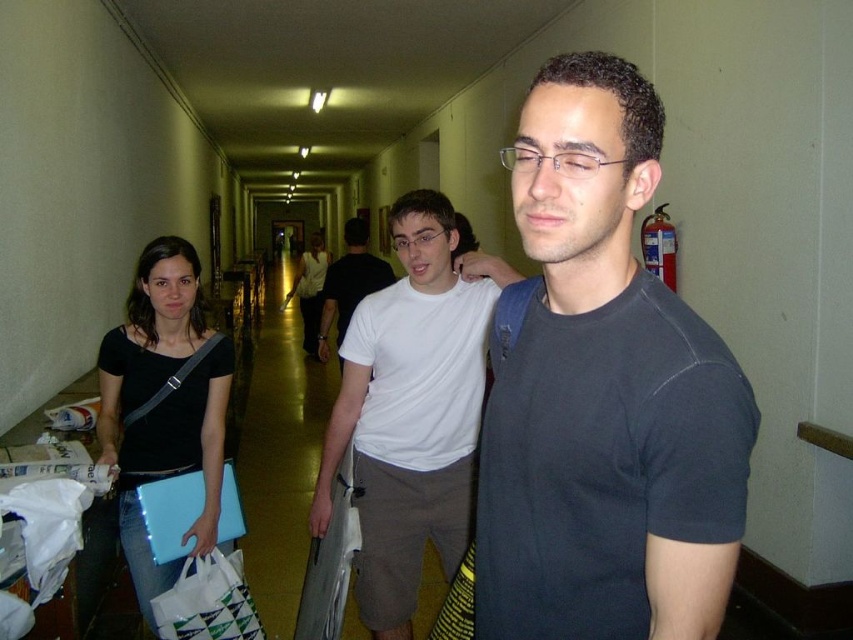
Question: Which of these objects is positioned closest to the dark gray t-shirt at center?

Choices:
 (A) white matte shirt at center
 (B) black fabric laptop at left
 (C) white fabric shopping bag at lower left
 (D) white matte t-shirt at center

Answer: (C)

Question: Considering the relative positions of dark gray t-shirt at center and white matte shirt at center in the image provided, where is dark gray t-shirt at center located with respect to white matte shirt at center?

Choices:
 (A) above
 (B) below

Answer: (B)

Question: In this image, where is black fabric laptop at left located relative to white matte shirt at center?

Choices:
 (A) right
 (B) left

Answer: (A)

Question: Among these points, which one is farthest from the camera?

Choices:
 (A) (x=316, y=275)
 (B) (x=639, y=292)
 (C) (x=134, y=278)

Answer: (A)

Question: Does dark gray t-shirt at center come in front of white fabric shopping bag at lower left?

Choices:
 (A) yes
 (B) no

Answer: (A)

Question: Which point is closer to the camera?

Choices:
 (A) (299, 285)
 (B) (221, 337)

Answer: (B)